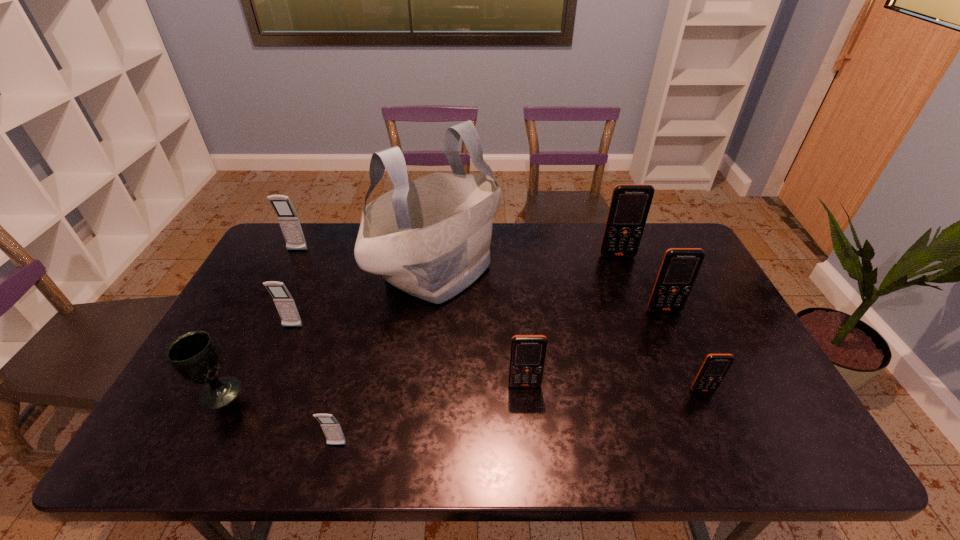
Identify the location of the tallest object. (430, 238).

Locate an element on the screen. The height and width of the screenshot is (540, 960). the biggest orange cellular telephone is located at coordinates (630, 203).

Where is `the farthest orange cellular telephone`? The image size is (960, 540). the farthest orange cellular telephone is located at coordinates (630, 203).

The height and width of the screenshot is (540, 960). Find the location of `the farthest gray cellular telephone`. the farthest gray cellular telephone is located at coordinates click(287, 217).

Identify the location of the leftmost gray cellular telephone. (287, 217).

At what (x,y) coordinates should I click in order to perform the action: click on the second farthest orange cellular telephone. Please return your answer as a coordinate pair (x, y). This screenshot has width=960, height=540. Looking at the image, I should click on (680, 266).

The height and width of the screenshot is (540, 960). In order to click on the third farthest cellular telephone in this screenshot , I will do `click(680, 266)`.

Find the location of a particular element. The image size is (960, 540). the second smallest gray cellular telephone is located at coordinates coord(285,304).

Where is `the third object from left to right`? The width and height of the screenshot is (960, 540). the third object from left to right is located at coordinates (285, 304).

The height and width of the screenshot is (540, 960). Identify the location of the fourth cellular telephone from right to left. (527, 357).